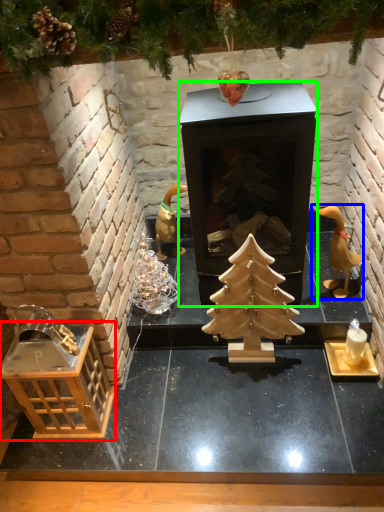
Question: Which is farther away from crate (highlighted by a red box)? toy (highlighted by a blue box) or fireplace (highlighted by a green box)?

Choices:
 (A) toy
 (B) fireplace

Answer: (A)